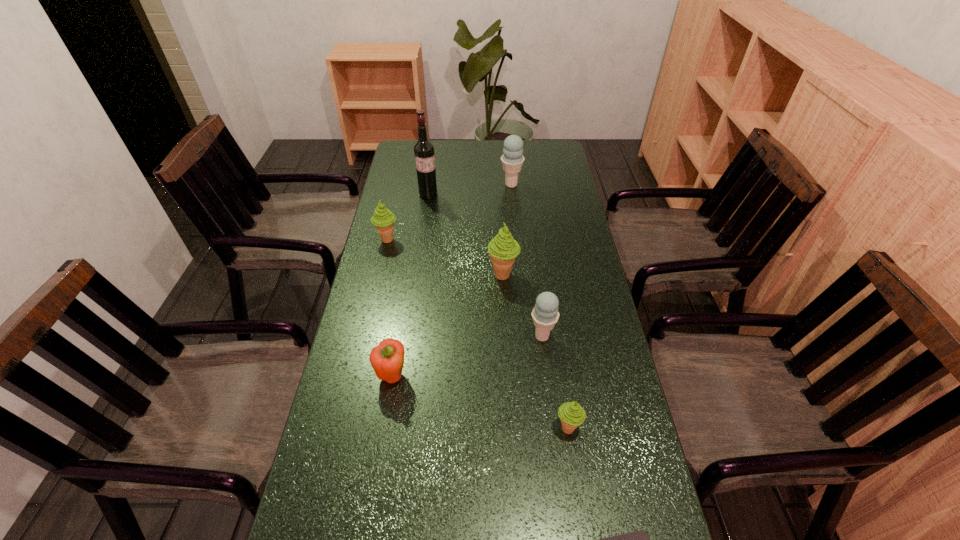
Where is `wine bottle at the left edge`? wine bottle at the left edge is located at coordinates (423, 149).

Find the location of a particular element. The height and width of the screenshot is (540, 960). icecream located in the left edge section of the desktop is located at coordinates (383, 219).

Identify the location of pepper present at the left edge. The height and width of the screenshot is (540, 960). (387, 359).

The width and height of the screenshot is (960, 540). In order to click on vacant space at the far edge in this screenshot , I will do `click(471, 157)`.

In the image, there is a desktop. At what (x,y) coordinates should I click in order to perform the action: click on vacant space at the left edge. Please return your answer as a coordinate pair (x, y). The height and width of the screenshot is (540, 960). Looking at the image, I should click on (369, 332).

In the image, there is a desktop. Where is `free space at the right edge`? The image size is (960, 540). free space at the right edge is located at coordinates (557, 193).

The image size is (960, 540). Find the location of `vacant area at the far right corner of the desktop`. vacant area at the far right corner of the desktop is located at coordinates (540, 156).

Image resolution: width=960 pixels, height=540 pixels. I want to click on free space between the pepper and the second green icecream from right to left, so click(447, 326).

Identify the location of empty space that is in between the smaller blue ice cream and the wine bottle. This screenshot has width=960, height=540. (485, 265).

Locate an element on the screen. The width and height of the screenshot is (960, 540). unoccupied position between the tallest object and the second farthest green icecream is located at coordinates (466, 234).